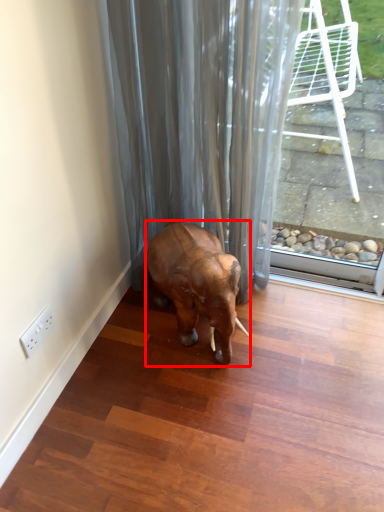
Question: From the image's perspective, considering the relative positions of elephant (annotated by the red box) and shower curtain in the image provided, where is elephant (annotated by the red box) located with respect to the staircase?

Choices:
 (A) below
 (B) above

Answer: (A)